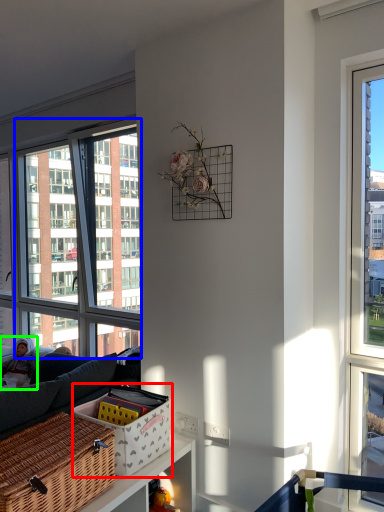
Question: Which is farther away from basket (highlighted by a red box)? window (highlighted by a blue box) or couple (highlighted by a green box)?

Choices:
 (A) window
 (B) couple

Answer: (A)